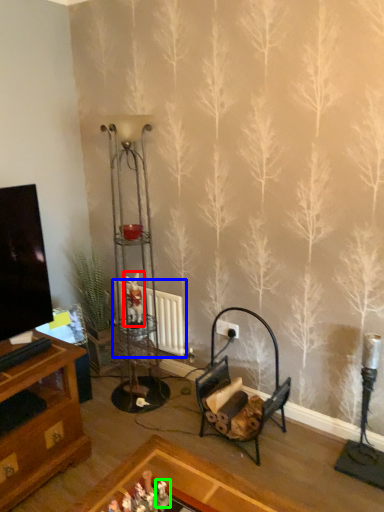
Question: Which object is the farthest from toy (highlighted by a red box)? Choose among these: radiator (highlighted by a blue box) or toy (highlighted by a green box).

Choices:
 (A) radiator
 (B) toy

Answer: (B)